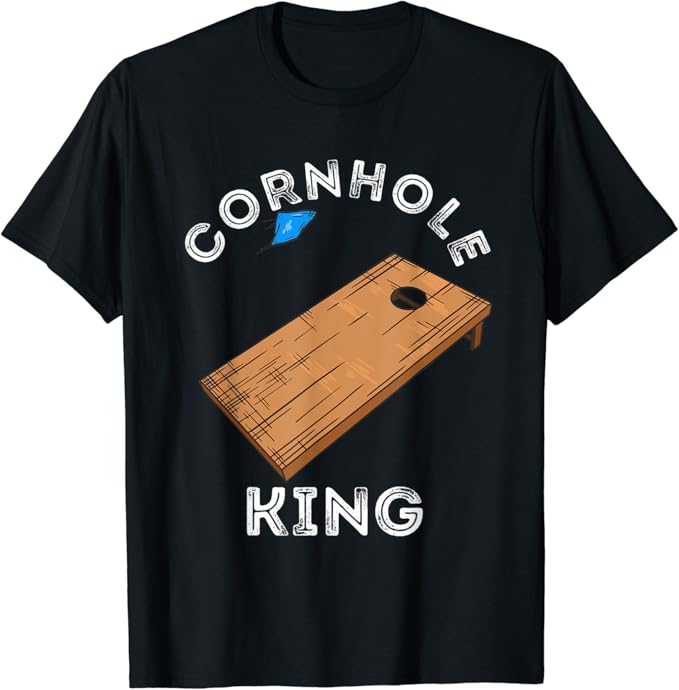
Image resolution: width=679 pixels, height=690 pixels. What are the coordinates of `bean bag` in the screenshot? It's located at (290, 230).